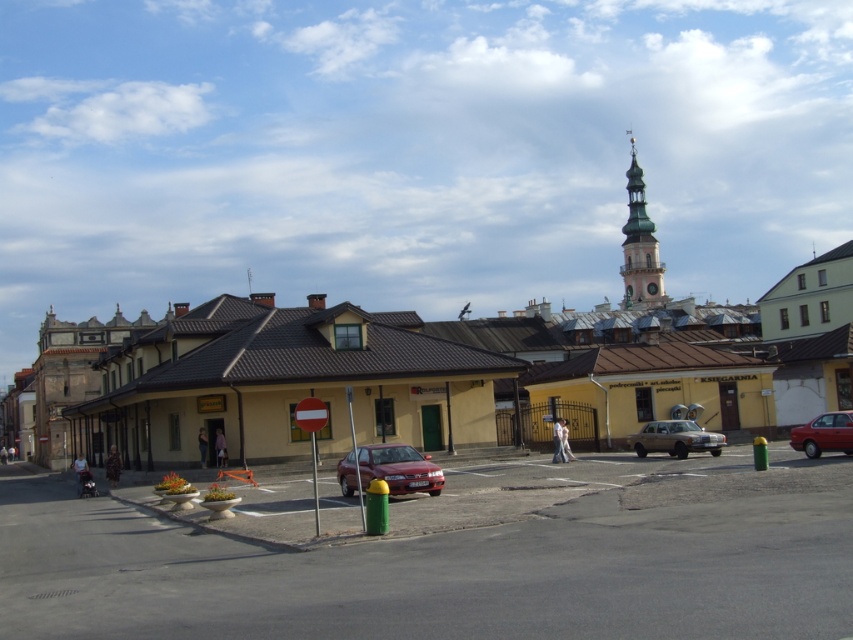
Who is more forward, (635, 170) or (351, 461)?

Point (351, 461)

Is green stone clock tower at upper right closer to camera compared to shiny red sedan at center?

No.

Which is in front, point (637, 209) or point (409, 456)?

Point (409, 456) is more forward.

At what (x,y) coordinates should I click in order to perform the action: click on green stone clock tower at upper right. Please return your answer as a coordinate pair (x, y). The image size is (853, 640). Looking at the image, I should click on click(639, 246).

Between point (425, 368) and point (650, 433), which one is positioned in front?

Point (650, 433) is in front.

Is yellow matte building at center bigger than gold metallic sedan at center-right?

Yes.

Is point (157, 416) in front of point (695, 449)?

No.

Where is `yellow matte building at center`? The image size is (853, 640). yellow matte building at center is located at coordinates (303, 364).

Does green stone clock tower at upper right have a greater width compared to shiny red sedan at lower right?

Correct, the width of green stone clock tower at upper right exceeds that of shiny red sedan at lower right.

Between green stone clock tower at upper right and shiny red sedan at lower right, which one has less height?

Standing shorter between the two is shiny red sedan at lower right.

Where is `green stone clock tower at upper right`? This screenshot has height=640, width=853. green stone clock tower at upper right is located at coordinates (639, 246).